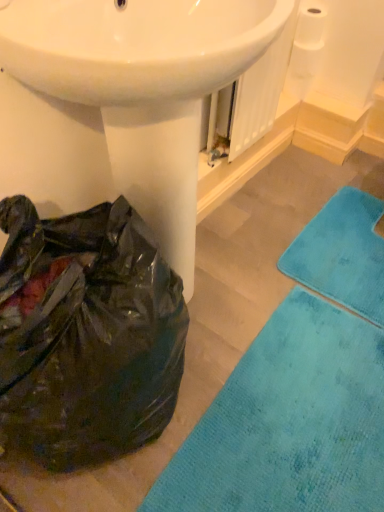
Question: Is teal soft rug at lower right positioned beyond the bounds of black plastic bag at lower left?

Choices:
 (A) yes
 (B) no

Answer: (A)

Question: Considering the relative positions of teal soft rug at lower right and black plastic bag at lower left in the image provided, is teal soft rug at lower right behind black plastic bag at lower left?

Choices:
 (A) no
 (B) yes

Answer: (B)

Question: From a real-world perspective, is teal soft rug at lower right physically below black plastic bag at lower left?

Choices:
 (A) yes
 (B) no

Answer: (A)

Question: Considering the relative positions of teal soft rug at lower right and black plastic bag at lower left in the image provided, is teal soft rug at lower right in front of black plastic bag at lower left?

Choices:
 (A) no
 (B) yes

Answer: (A)

Question: Is teal soft rug at lower right not near black plastic bag at lower left?

Choices:
 (A) yes
 (B) no

Answer: (B)

Question: Is teal soft rug at lower right thinner than black plastic bag at lower left?

Choices:
 (A) yes
 (B) no

Answer: (B)

Question: Does black plastic bag at lower left have a larger size compared to teal soft rug at lower right?

Choices:
 (A) no
 (B) yes

Answer: (B)

Question: Can you confirm if black plastic bag at lower left is wider than teal soft rug at lower right?

Choices:
 (A) yes
 (B) no

Answer: (B)

Question: Considering the relative positions of black plastic bag at lower left and teal soft rug at lower right in the image provided, is black plastic bag at lower left in front of teal soft rug at lower right?

Choices:
 (A) yes
 (B) no

Answer: (A)

Question: Is black plastic bag at lower left facing away from teal soft rug at lower right?

Choices:
 (A) yes
 (B) no

Answer: (B)

Question: Is black plastic bag at lower left at the right side of teal soft rug at lower right?

Choices:
 (A) no
 (B) yes

Answer: (A)

Question: Is black plastic bag at lower left to the left of teal soft rug at lower right from the viewer's perspective?

Choices:
 (A) yes
 (B) no

Answer: (A)

Question: Is white matte toilet paper at upper right oriented towards teal soft rug at lower right?

Choices:
 (A) yes
 (B) no

Answer: (B)